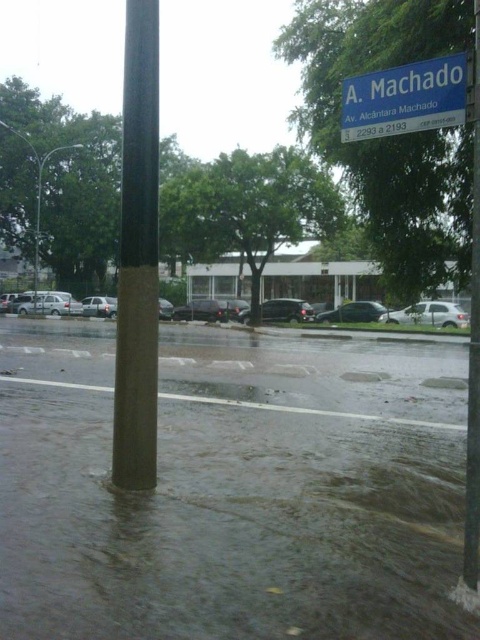
Question: Can you confirm if dark wet water at lower center is positioned to the left of blue plastic street sign at upper center?

Choices:
 (A) no
 (B) yes

Answer: (B)

Question: Which object is closer to the camera taking this photo?

Choices:
 (A) silver metallic sedan at center
 (B) satin black car at center

Answer: (A)

Question: Which object is positioned farthest from the white matte car at center?

Choices:
 (A) concrete pole at center
 (B) dark wet water at lower center

Answer: (B)

Question: Is white matte car at center above shiny black sedan at center?

Choices:
 (A) no
 (B) yes

Answer: (A)

Question: Is blue plastic street sign at upper center to the right of satin black car at center from the viewer's perspective?

Choices:
 (A) no
 (B) yes

Answer: (A)

Question: Which object is closer to the camera taking this photo?

Choices:
 (A) concrete pole at center
 (B) silver metallic sedan at center
 (C) shiny silver sedan at center

Answer: (A)